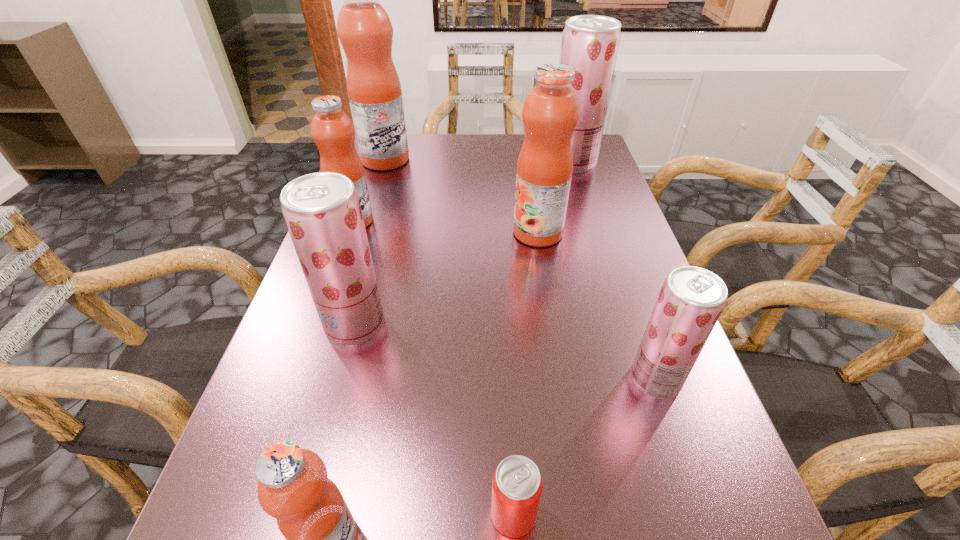
Identify the location of the shortest object. The height and width of the screenshot is (540, 960). (517, 485).

What are the coordinates of `can` in the screenshot? It's located at (517, 485).

The image size is (960, 540). Find the location of `free space located 0.190m on the front label of the biggest orange fruit juice`. free space located 0.190m on the front label of the biggest orange fruit juice is located at coordinates (473, 160).

The height and width of the screenshot is (540, 960). I want to click on vacant space positioned 0.210m on the left of the farthest strawberry fruit juice, so click(477, 162).

You are a GUI agent. You are given a task and a screenshot of the screen. Output one action in this format:
    pyautogui.click(x=<x>, y=<y>)
    Task: Click on the vacant space located on the front label of the third object from right to left
    Image resolution: width=960 pixels, height=540 pixels.
    Given the screenshot: What is the action you would take?
    pyautogui.click(x=388, y=233)

The image size is (960, 540). I want to click on vacant space located on the front label of the third object from right to left, so click(x=358, y=233).

The width and height of the screenshot is (960, 540). I want to click on vacant position located 0.330m on the front label of the third object from right to left, so click(x=375, y=233).

Find the location of a particular element. The height and width of the screenshot is (540, 960). free space located 0.220m on the back of the second biggest strawberry fruit juice is located at coordinates (379, 236).

Find the location of `vacant space situated on the front label of the second smallest orange fruit juice`. vacant space situated on the front label of the second smallest orange fruit juice is located at coordinates (527, 221).

Where is `vacant space positioned 0.350m on the back of the sixth farthest object`? The image size is (960, 540). vacant space positioned 0.350m on the back of the sixth farthest object is located at coordinates (607, 238).